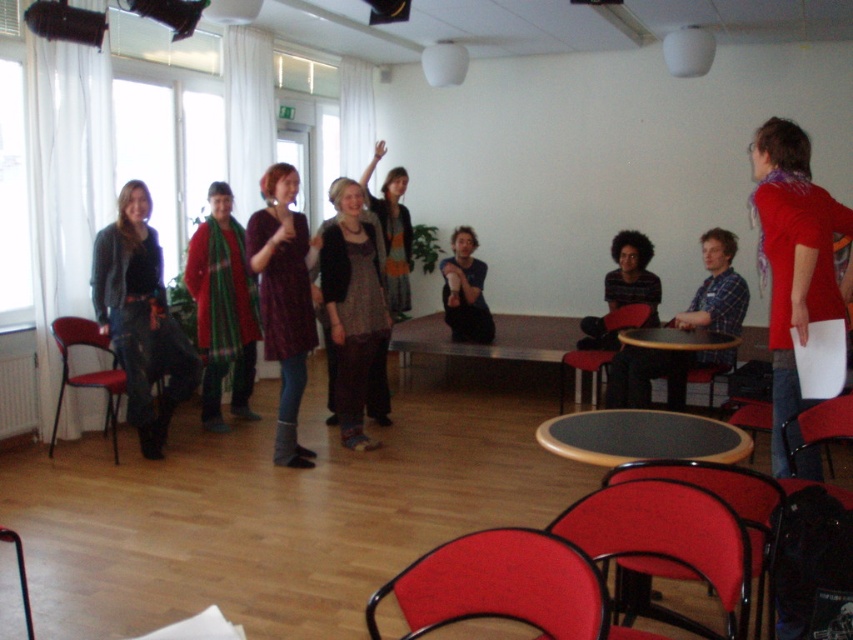
Is matte purple dress at center shorter than striped cotton shirt at center?

No.

Which is behind, point (267, 348) or point (612, 372)?

The point (612, 372) is behind.

Find the location of `matte purple dress at center`. matte purple dress at center is located at coordinates (283, 300).

Can you confirm if red fabric chair at lower center is thinner than leather-like red chair at lower right?

No.

Where is `red fabric chair at lower center`? This screenshot has width=853, height=640. red fabric chair at lower center is located at coordinates (503, 586).

Is knitted sweater at center positioned in front of leather-like red chair at lower right?

That is False.

Can you confirm if knitted sweater at center is taller than leather-like red chair at lower right?

Yes, knitted sweater at center is taller than leather-like red chair at lower right.

The width and height of the screenshot is (853, 640). What do you see at coordinates (392, 230) in the screenshot?
I see `knitted sweater at center` at bounding box center [392, 230].

I want to click on knitted sweater at center, so click(x=392, y=230).